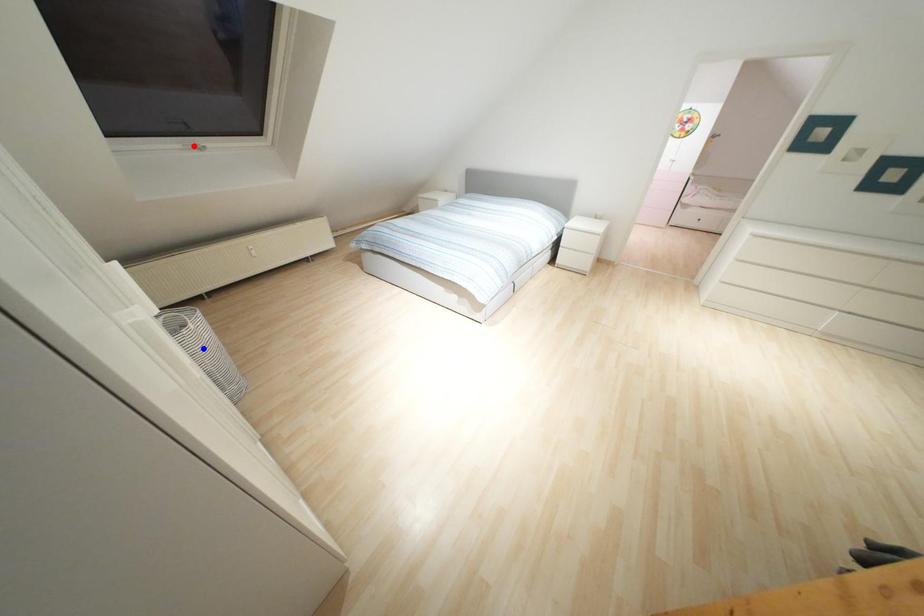
Question: Two points are marked on the image. Which point is closer to the camera?

Choices:
 (A) Blue point is closer.
 (B) Red point is closer.

Answer: (A)